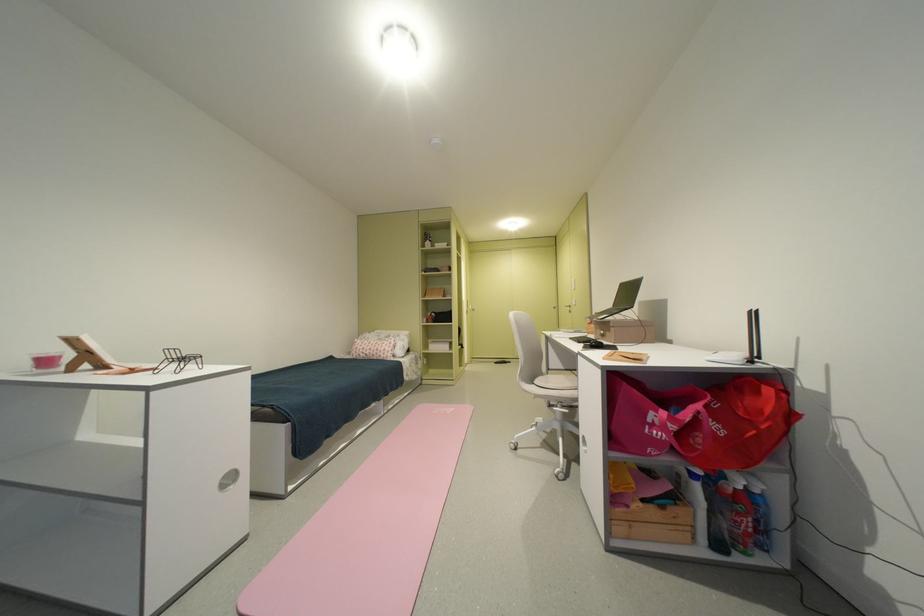
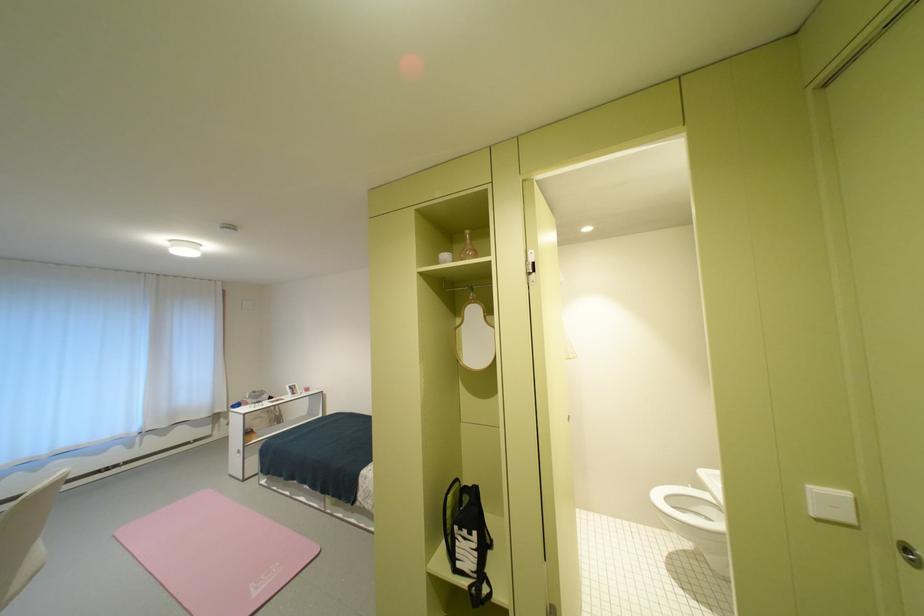
In the second image, find the point that corresponds to pixel 444 413 in the first image.

(286, 565)